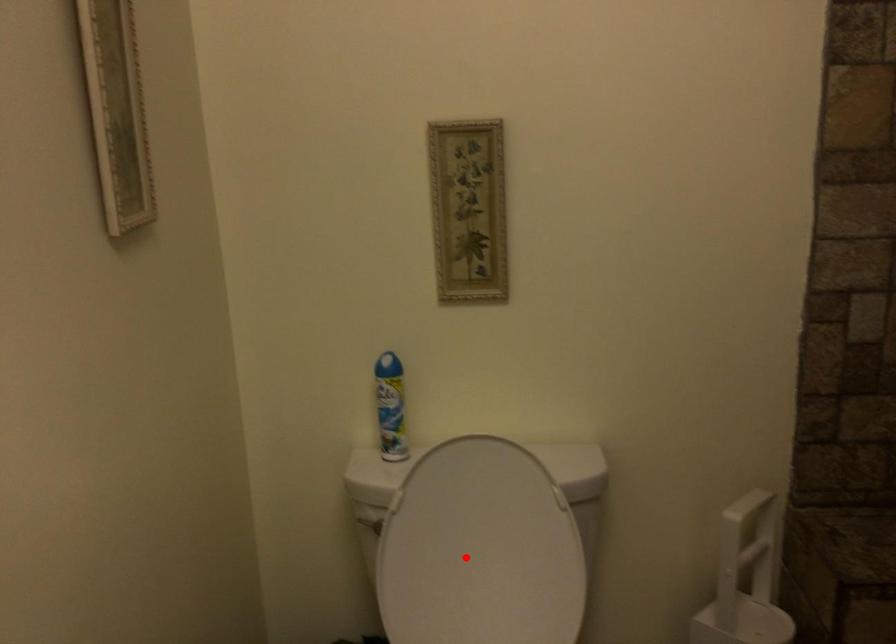
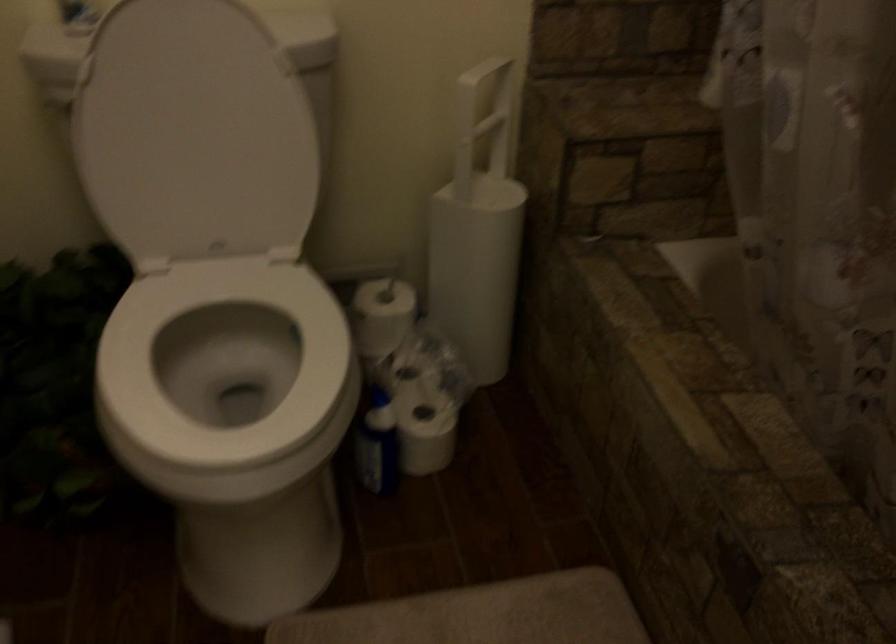
Question: I am providing you with two images of the same scene from different viewpoints. A red point is marked on the first image. Can you still see the location of the red point in image 2?

Choices:
 (A) Yes
 (B) No

Answer: (A)